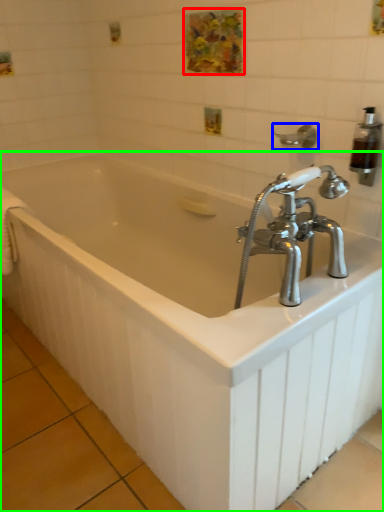
Question: Which is nearer to the art (highlighted by a red box)? shower (highlighted by a blue box) or bathtub (highlighted by a green box).

Choices:
 (A) shower
 (B) bathtub

Answer: (A)